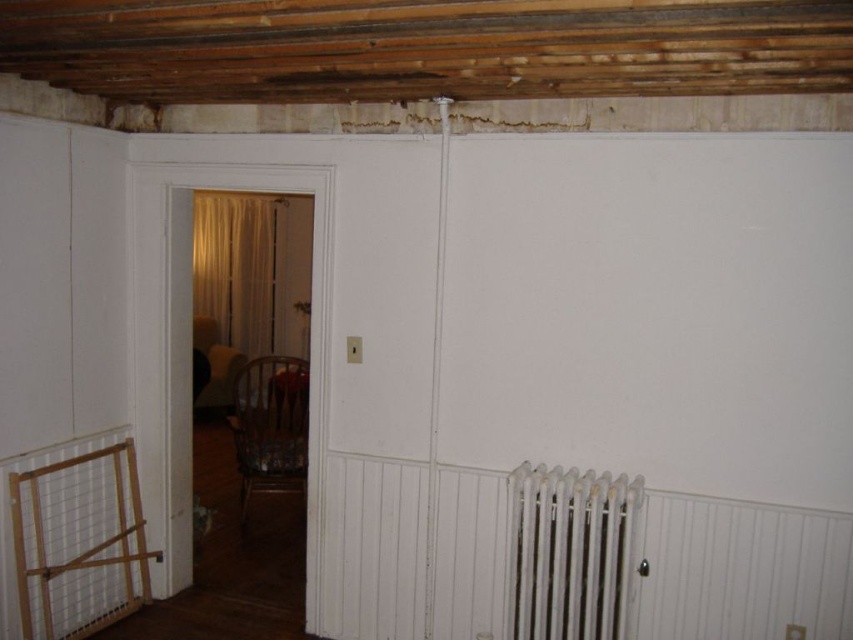
Question: Is white metal radiator at lower right positioned before beige sheer curtain at center?

Choices:
 (A) no
 (B) yes

Answer: (B)

Question: Is white metal radiator at lower right behind beige sheer curtain at center?

Choices:
 (A) yes
 (B) no

Answer: (B)

Question: Which point is farther from the camera taking this photo?

Choices:
 (A) (535, 602)
 (B) (212, 305)

Answer: (B)

Question: Which object is closer to the camera taking this photo?

Choices:
 (A) beige sheer curtain at center
 (B) white metal radiator at lower right

Answer: (B)

Question: Is white metal radiator at lower right positioned at the back of beige sheer curtain at center?

Choices:
 (A) no
 (B) yes

Answer: (A)

Question: Which of the following is the closest to the observer?

Choices:
 (A) beige sheer curtain at center
 (B) white metal radiator at lower right

Answer: (B)